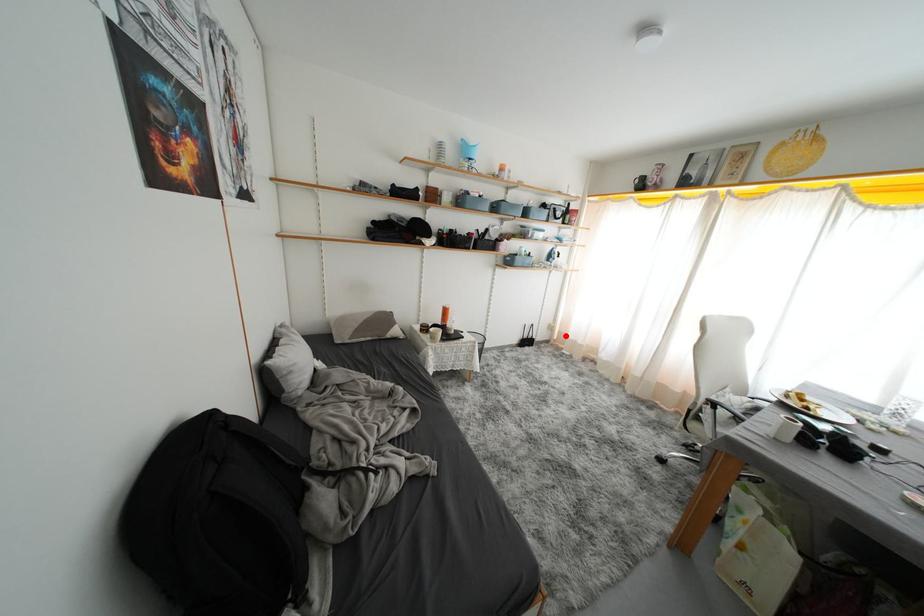
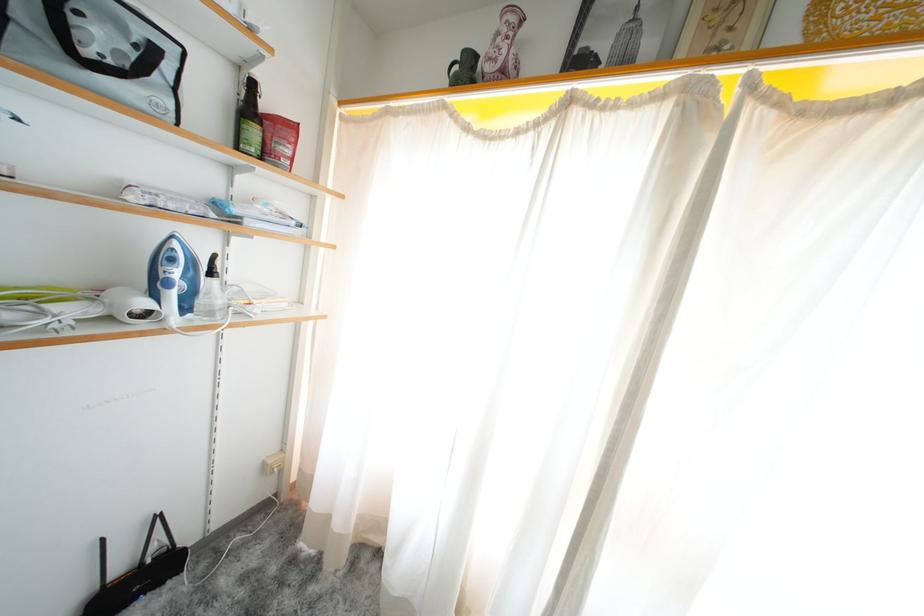
Question: I am providing you with two images of the same scene from different viewpoints. In image1, a red point is highlighted. Considering the same 3D point in image2, which of the following is correct?

Choices:
 (A) It is closer
 (B) It is farther

Answer: (B)